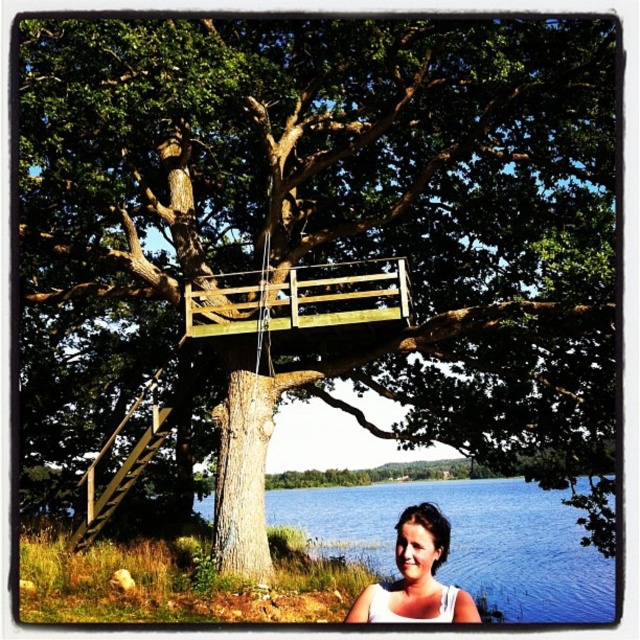
Is wooden at upper center below wooden at left?

Incorrect, wooden at upper center is not positioned below wooden at left.

Which is behind, point (390, 260) or point (115, 484)?

Positioned behind is point (115, 484).

This screenshot has width=640, height=640. I want to click on wooden at upper center, so click(x=300, y=298).

I want to click on wooden at upper center, so click(300, 298).

Can you confirm if blue water at lower center is taller than wooden at upper center?

Indeed, blue water at lower center has a greater height compared to wooden at upper center.

Is blue water at lower center smaller than wooden at upper center?

No, blue water at lower center is not smaller than wooden at upper center.

This screenshot has width=640, height=640. What do you see at coordinates (468, 541) in the screenshot?
I see `blue water at lower center` at bounding box center [468, 541].

Locate an element on the screen. blue water at lower center is located at coordinates (468, 541).

Can you confirm if wooden at upper center is positioned to the right of white fabric at lower center?

Incorrect, wooden at upper center is not on the right side of white fabric at lower center.

Which is below, wooden at upper center or white fabric at lower center?

white fabric at lower center is lower down.

Is point (248, 273) behind point (406, 532)?

Yes, point (248, 273) is farther from viewer.

I want to click on wooden at upper center, so click(300, 298).